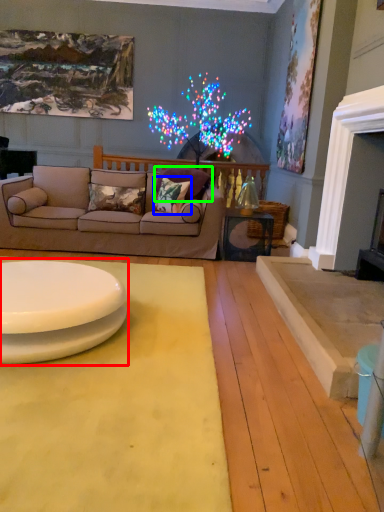
Question: Based on their relative distances, which object is farther from table (highlighted by a red box)? Choose from pillow (highlighted by a blue box) and pillow (highlighted by a green box).

Choices:
 (A) pillow
 (B) pillow

Answer: (B)